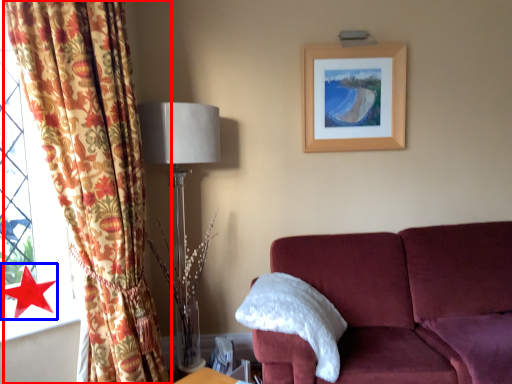
Question: Which of the following is the closest to the observer, curtain (highlighted by a red box) or star (highlighted by a blue box)?

Choices:
 (A) curtain
 (B) star

Answer: (A)